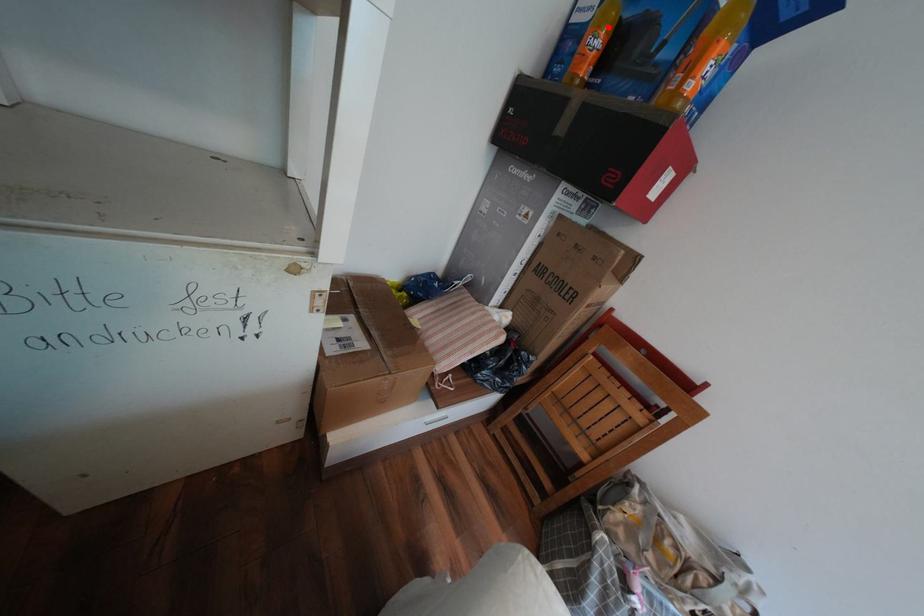
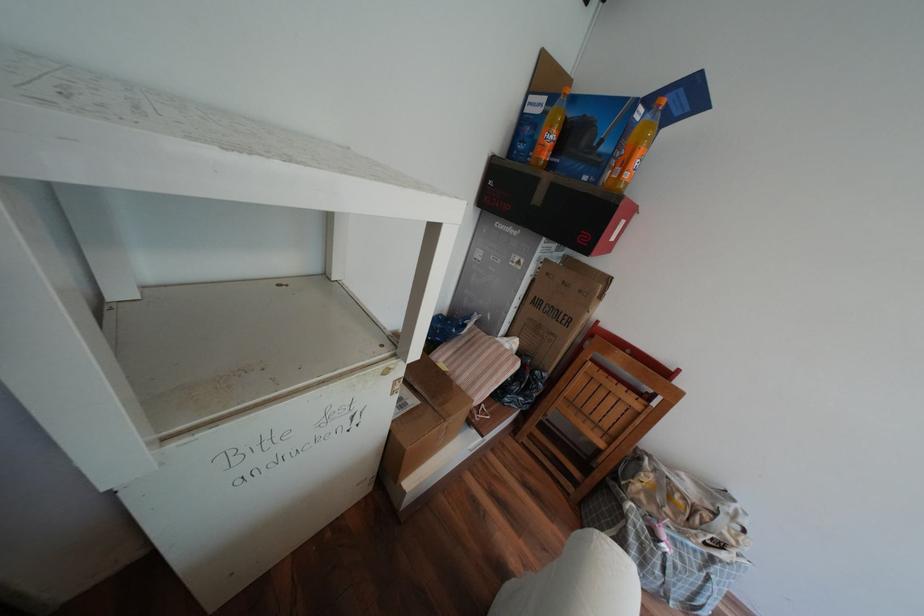
Find the pixel in the second image that matches the highlighted location in the first image.

(561, 127)